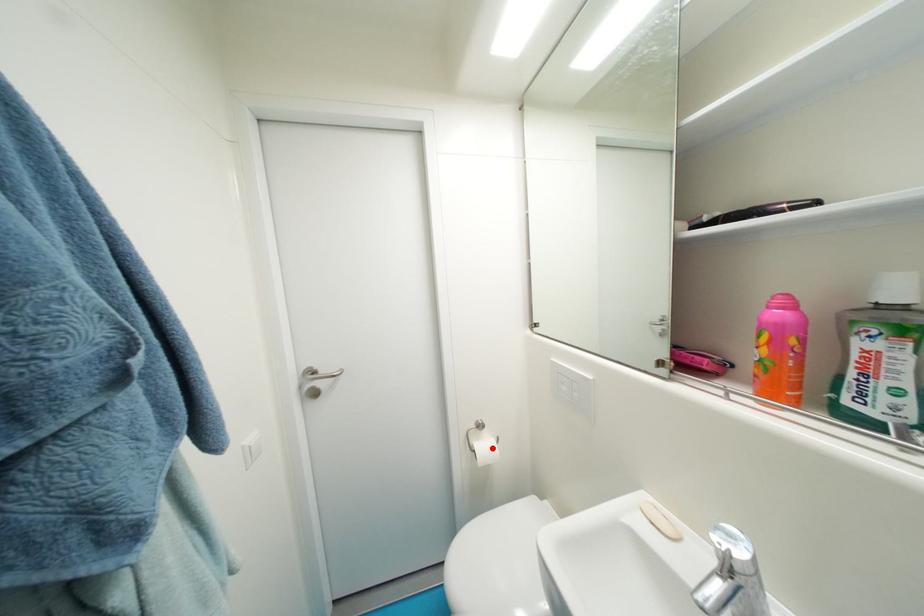
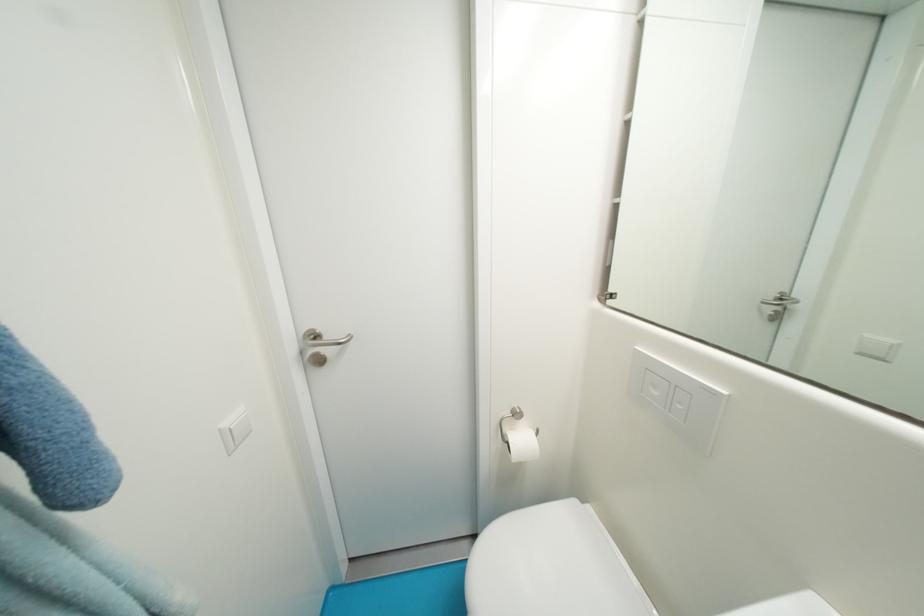
Where in the second image is the point corresponding to the highlighted location from the first image?

(529, 442)